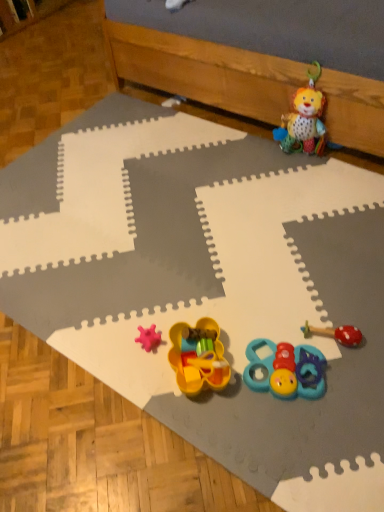
I want to click on vacant space that's between plush fabric lion at upper right, the 4th toy in the front-to-back sequence, and teal rubber teething toy at lower center, acting as the 4th toy starting from the top, so click(294, 238).